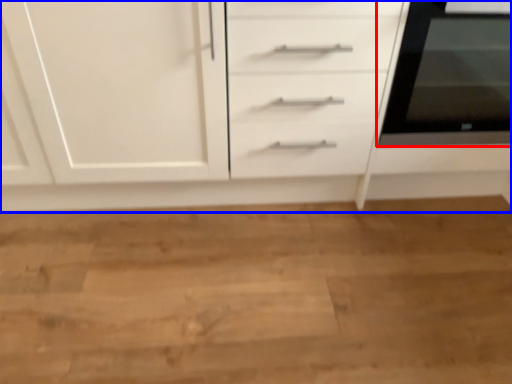
Question: Which object appears closest to the camera in this image, home appliance (highlighted by a red box) or chest of drawers (highlighted by a blue box)?

Choices:
 (A) home appliance
 (B) chest of drawers

Answer: (B)